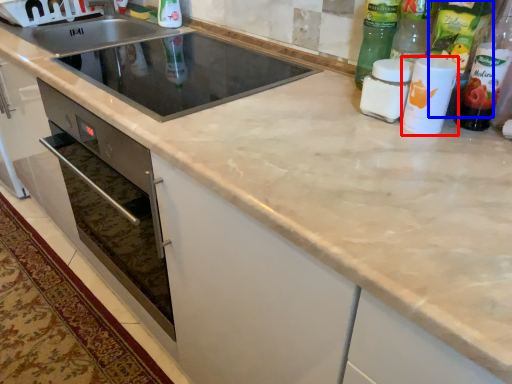
Question: Which object appears closest to the camera in this image, bottle (highlighted by a red box) or bottle (highlighted by a blue box)?

Choices:
 (A) bottle
 (B) bottle

Answer: (A)